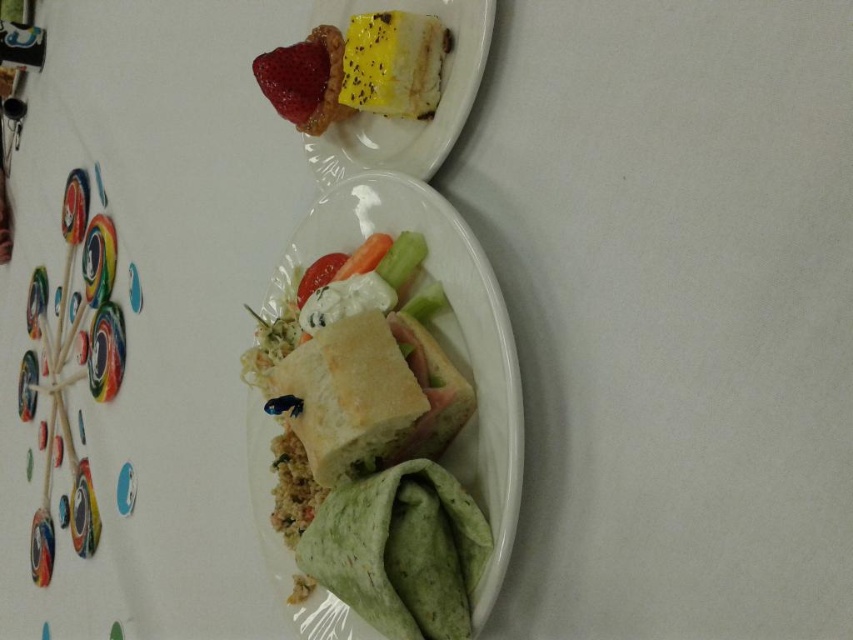
In the scene shown: You are looking at the plates of food from a slightly angled perspective. Which object is positioned at the center of the foreground plate? Is it the white bread at center or the folded green wrap to its right?

The white bread at center is located at point (442,330), which is the center of the foreground plate, so the white bread at center is positioned at the center.

You are arranging a picnic basket and see the white bread at center and the red matte strawberry at upper left in the image. Which item is positioned more to the right?

The white bread at center is positioned more to the right than the red matte strawberry at upper left.